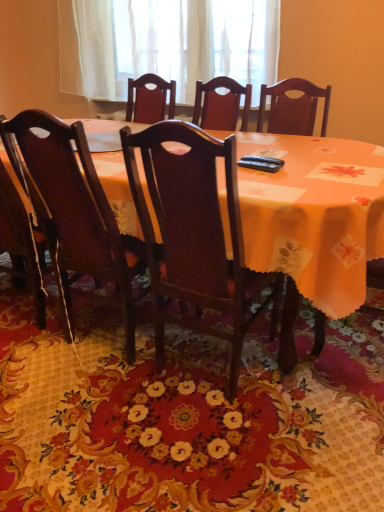
Question: Relative to floral carpet at center, is dark wood chair at center, placed as the 1th chair when sorted from right to left, in front or behind?

Choices:
 (A) behind
 (B) front

Answer: (A)

Question: Is dark wood chair at center, the second chair from the left, wider or thinner than floral carpet at center?

Choices:
 (A) thin
 (B) wide

Answer: (A)

Question: Which object is positioned closest to the wooden chair at center, acting as the first chair starting from the left?

Choices:
 (A) floral carpet at center
 (B) dark wood chair at center, placed as the 1th chair when sorted from right to left
 (C) orange fabric table at center
 (D) white sheer curtain at upper center

Answer: (B)

Question: Which object is the closest to the wooden chair at center, acting as the first chair starting from the left?

Choices:
 (A) orange fabric table at center
 (B) white sheer curtain at upper center
 (C) dark wood chair at center, placed as the 1th chair when sorted from right to left
 (D) floral carpet at center

Answer: (C)